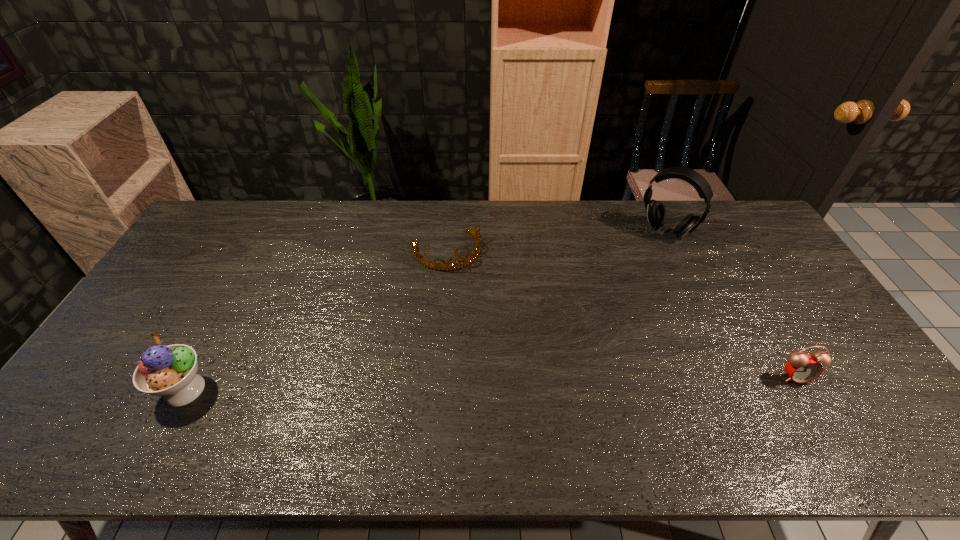
You are a GUI agent. You are given a task and a screenshot of the screen. Output one action in this format:
    pyautogui.click(x=<x>, y=<y>)
    Task: Click on the object located at the right edge
    
    Given the screenshot: What is the action you would take?
    pyautogui.click(x=802, y=368)

Where is `object positioned at the near right corner`? This screenshot has width=960, height=540. object positioned at the near right corner is located at coordinates (802, 368).

The width and height of the screenshot is (960, 540). I want to click on free point at the far edge, so click(x=347, y=228).

This screenshot has height=540, width=960. In the image, there is a desktop. In order to click on vacant space at the near edge in this screenshot , I will do `click(351, 398)`.

This screenshot has height=540, width=960. In the image, there is a desktop. What are the coordinates of `vacant space at the left edge` in the screenshot? It's located at pyautogui.click(x=227, y=248).

Where is `vacant space at the far left corner`? This screenshot has width=960, height=540. vacant space at the far left corner is located at coordinates (211, 214).

Image resolution: width=960 pixels, height=540 pixels. In the image, there is a desktop. In order to click on vacant space at the far right corner in this screenshot , I will do `click(723, 212)`.

In order to click on empty location between the third shortest object and the third object from left to right in this screenshot , I will do `click(425, 310)`.

Locate an element on the screen. free area in between the earphone and the third tallest object is located at coordinates (731, 303).

The image size is (960, 540). Find the location of `vacant space in between the alarm clock and the tiara`. vacant space in between the alarm clock and the tiara is located at coordinates (621, 314).